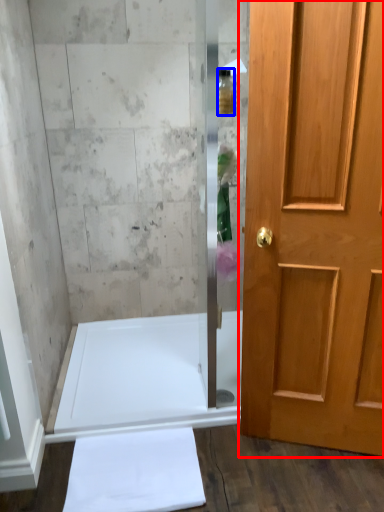
Question: Which point is further to the camera, door (highlighted by a red box) or toiletry (highlighted by a blue box)?

Choices:
 (A) door
 (B) toiletry

Answer: (B)